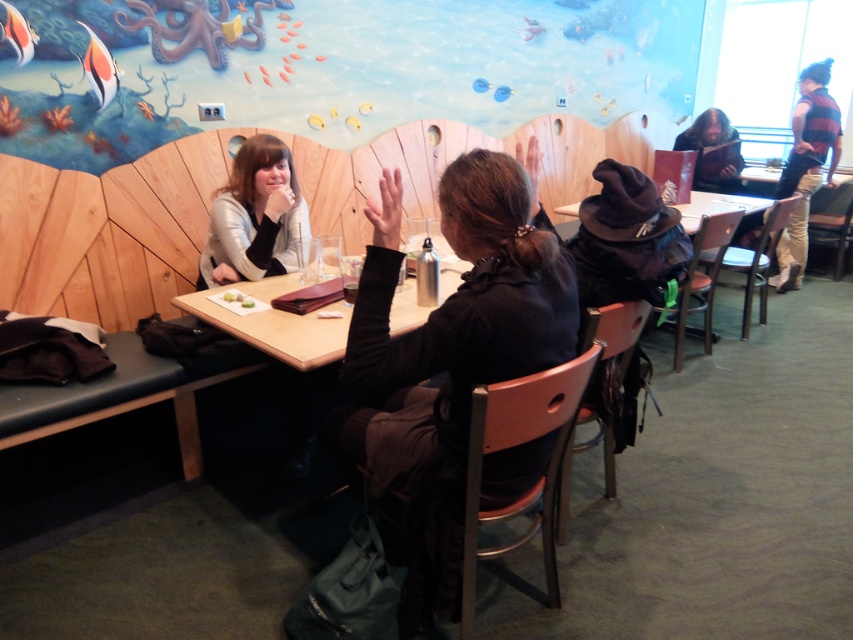
Who is positioned more to the right, matte silver jacket at left or wooden table at center?

wooden table at center is more to the right.

Based on the photo, does matte silver jacket at left appear under wooden table at center?

No.

Where is `matte silver jacket at left`? The image size is (853, 640). matte silver jacket at left is located at coordinates (254, 216).

At what (x,y) coordinates should I click in order to perform the action: click on matte silver jacket at left. Please return your answer as a coordinate pair (x, y). This screenshot has width=853, height=640. Looking at the image, I should click on (254, 216).

Can you confirm if matte silver jacket at left is positioned above striped wool sweater at upper right?

Actually, matte silver jacket at left is below striped wool sweater at upper right.

Is matte silver jacket at left bigger than striped wool sweater at upper right?

No, matte silver jacket at left is not bigger than striped wool sweater at upper right.

Is point (241, 236) more distant than point (811, 93)?

That is False.

Find the location of `matte silver jacket at left`. matte silver jacket at left is located at coordinates (254, 216).

Who is lower down, wooden table at center or striped wool sweater at upper right?

wooden table at center is below.

Is wooden table at center below striped wool sweater at upper right?

Indeed, wooden table at center is positioned under striped wool sweater at upper right.

Does point (270, 321) lie in front of point (828, 118)?

Yes, point (270, 321) is closer to viewer.

Identify the location of wooden table at center. The width and height of the screenshot is (853, 640). (276, 323).